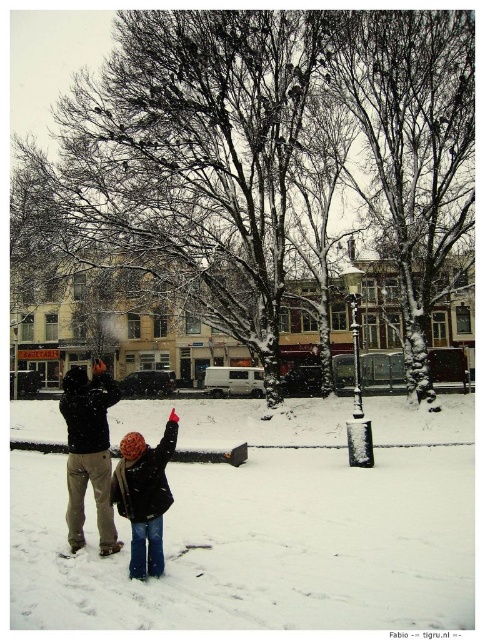
You are a photographer trying to capture the winter scene. You want to ensure that the white fluffy snow at center and the black woolen hat at center are both clearly visible in your shot. Based on their positions, which object should you focus on first to ensure proper depth of field?

The black woolen hat at center is above the white fluffy snow at center, so focusing on the black woolen hat at center first will ensure both are in focus due to its position closer to the camera.

You are standing in the winter scene and want to know where the white fluffy snow at center is in relation to the dark brown leather jacket at center. Is the snow above or below the jacket?

The white fluffy snow at center is below the dark brown leather jacket at center.